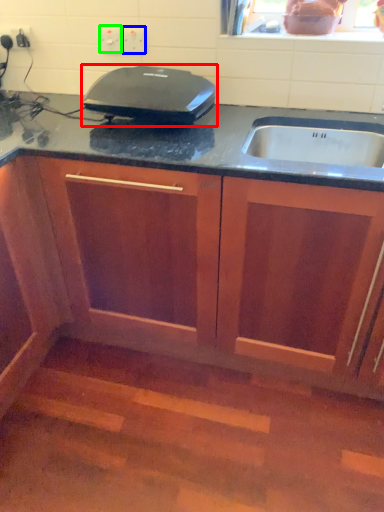
Question: Based on their relative distances, which object is farther from home appliance (highlighted by a red box)? Choose from electric outlet (highlighted by a blue box) and electric outlet (highlighted by a green box).

Choices:
 (A) electric outlet
 (B) electric outlet

Answer: (B)